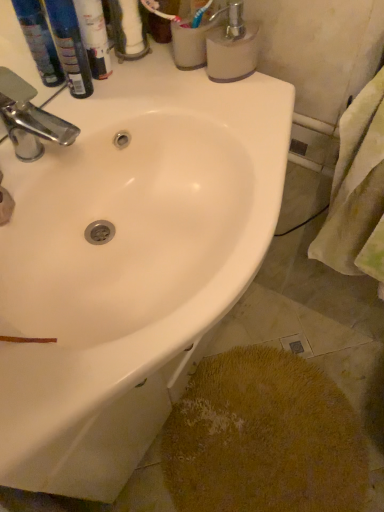
Question: Is white glossy tube at upper left, acting as the 2th toiletry starting from the left, spatially inside white matte soap dispenser at upper right, or outside of it?

Choices:
 (A) outside
 (B) inside

Answer: (A)

Question: Considering the positions of white glossy tube at upper left, acting as the 2th toiletry starting from the left, and white matte soap dispenser at upper right in the image, is white glossy tube at upper left, acting as the 2th toiletry starting from the left, taller or shorter than white matte soap dispenser at upper right?

Choices:
 (A) short
 (B) tall

Answer: (B)

Question: Estimate the real-world distances between objects in this image. Which object is closer to the white matte toilet paper at upper center?

Choices:
 (A) white matte soap dispenser at upper right
 (B) white glossy sink at upper center
 (C) blue plastic bottles at upper left, marked as the first toiletry in a left-to-right arrangement
 (D) yellow textured rug at lower right
 (E) white glossy tube at upper left, acting as the 2th toiletry starting from the left

Answer: (E)

Question: Which of these objects is positioned farthest from the white matte toilet paper at upper center?

Choices:
 (A) chrome metallic faucet at upper left
 (B) blue plastic bottles at upper left, marked as the first toiletry in a left-to-right arrangement
 (C) white glossy tube at upper left, placed as the 1th toiletry when sorted from right to left
 (D) yellow textured rug at lower right
 (E) white matte soap dispenser at upper right

Answer: (D)